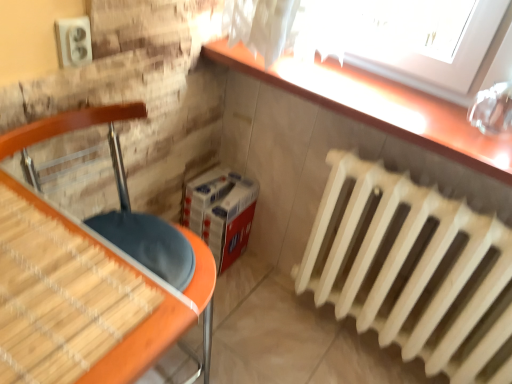
Question: Can you confirm if matte orange table at lower left is smaller than white wooden radiator at lower right?

Choices:
 (A) no
 (B) yes

Answer: (A)

Question: Is matte orange table at lower left to the right of white wooden radiator at lower right from the viewer's perspective?

Choices:
 (A) yes
 (B) no

Answer: (B)

Question: Considering the relative sizes of matte orange table at lower left and white wooden radiator at lower right in the image provided, is matte orange table at lower left shorter than white wooden radiator at lower right?

Choices:
 (A) no
 (B) yes

Answer: (A)

Question: Is matte orange table at lower left taller than white wooden radiator at lower right?

Choices:
 (A) yes
 (B) no

Answer: (A)

Question: Is matte orange table at lower left in front of white wooden radiator at lower right?

Choices:
 (A) no
 (B) yes

Answer: (B)

Question: Does point (369, 117) appear closer or farther from the camera than point (502, 276)?

Choices:
 (A) closer
 (B) farther

Answer: (B)

Question: In the image, is smooth wooden counter at upper right on the left side or the right side of white wooden radiator at lower right?

Choices:
 (A) right
 (B) left

Answer: (B)

Question: Relative to white wooden radiator at lower right, is smooth wooden counter at upper right in front or behind?

Choices:
 (A) behind
 (B) front

Answer: (A)

Question: Choose the correct answer: Is smooth wooden counter at upper right inside white wooden radiator at lower right or outside it?

Choices:
 (A) outside
 (B) inside

Answer: (A)

Question: Is point (139, 326) closer or farther from the camera than point (422, 286)?

Choices:
 (A) farther
 (B) closer

Answer: (B)

Question: Looking at their shapes, would you say matte orange table at lower left is wider or thinner than white wooden radiator at lower right?

Choices:
 (A) thin
 (B) wide

Answer: (B)

Question: From a real-world perspective, relative to white wooden radiator at lower right, is matte orange table at lower left vertically above or below?

Choices:
 (A) below
 (B) above

Answer: (B)

Question: Based on their sizes in the image, would you say matte orange table at lower left is bigger or smaller than white wooden radiator at lower right?

Choices:
 (A) small
 (B) big

Answer: (B)

Question: From the image's perspective, is matte orange table at lower left positioned above or below smooth wooden counter at upper right?

Choices:
 (A) above
 (B) below

Answer: (B)

Question: Considering their positions, is matte orange table at lower left located in front of or behind smooth wooden counter at upper right?

Choices:
 (A) front
 (B) behind

Answer: (A)